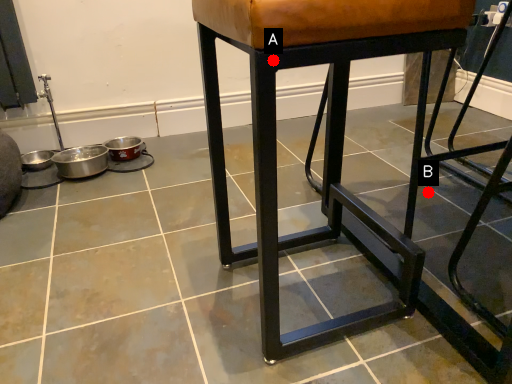
Question: Two points are circled on the image, labeled by A and B beside each circle. Which point is closer to the camera?

Choices:
 (A) A is closer
 (B) B is closer

Answer: (A)